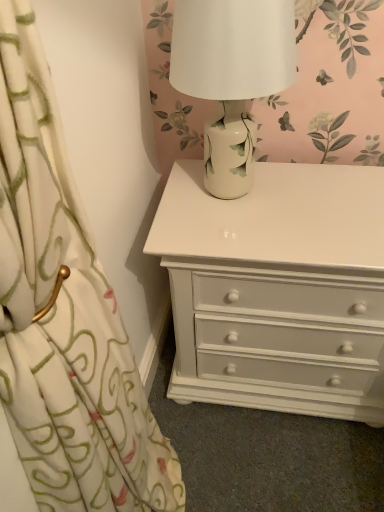
Question: From their relative heights in the image, would you say white glossy chest of drawers at center is taller or shorter than white ceramic lamp at upper center?

Choices:
 (A) short
 (B) tall

Answer: (B)

Question: Is white glossy chest of drawers at center situated inside white ceramic lamp at upper center or outside?

Choices:
 (A) outside
 (B) inside

Answer: (A)

Question: From a real-world perspective, is white glossy chest of drawers at center physically located above or below white ceramic lamp at upper center?

Choices:
 (A) below
 (B) above

Answer: (A)

Question: Considering the positions of white ceramic lamp at upper center and white glossy chest of drawers at center in the image, is white ceramic lamp at upper center bigger or smaller than white glossy chest of drawers at center?

Choices:
 (A) small
 (B) big

Answer: (A)

Question: Considering their positions, is white ceramic lamp at upper center located in front of or behind white glossy chest of drawers at center?

Choices:
 (A) behind
 (B) front

Answer: (B)

Question: Considering the positions of white ceramic lamp at upper center and white glossy chest of drawers at center in the image, is white ceramic lamp at upper center wider or thinner than white glossy chest of drawers at center?

Choices:
 (A) thin
 (B) wide

Answer: (A)

Question: Considering the positions of point (244, 170) and point (269, 349), is point (244, 170) closer or farther from the camera than point (269, 349)?

Choices:
 (A) closer
 (B) farther

Answer: (A)